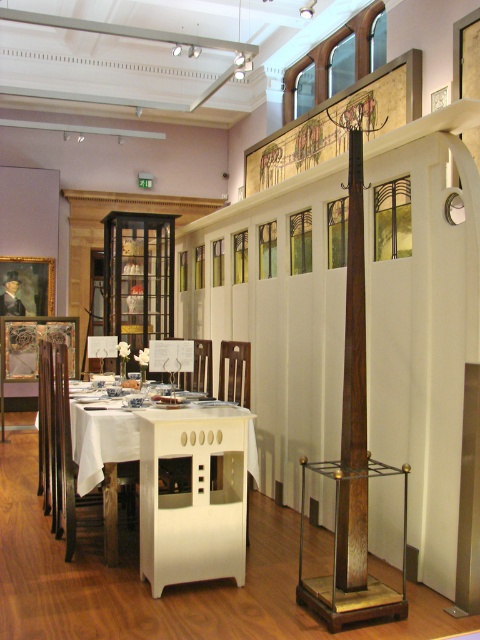
You are a visitor standing in the museum and want to sit down to examine the table settings. There is a white glossy table at center and a wooden chair at center. Which object would you need to move closer to the entrance to make space for a wheelchair ramp?

The wooden chair at center would need to be moved closer to the entrance because the white glossy table at center is larger and likely fixed in place, making it impractical to move.

You are a photographer standing at the entrance of the museum gallery. You want to take a photo of the white glossy table at center. If your camera has a maximum focus range of 10 feet, will you be able to capture a clear image of the table from your current position?

The white glossy table at center and camera are 11.78 feet apart from each other, which exceeds the camera maximum focus range of 10 feet. Therefore, you will not be able to capture a clear image of the table from your current position.

You are standing in the museum room and want to determine the relative positions of two points marked in the image. Which point is closer to you, point (181, 387) or point (232, 342)?

Point (181, 387) is further to the viewer than point (232, 342), so point (232, 342) is closer to you.